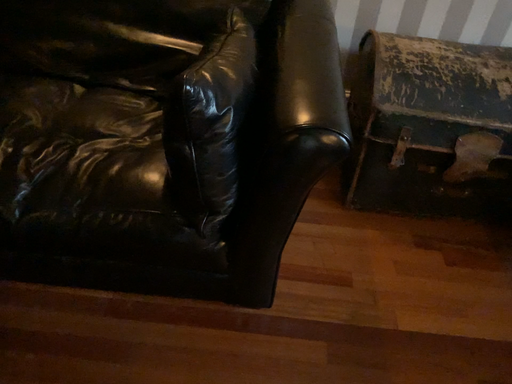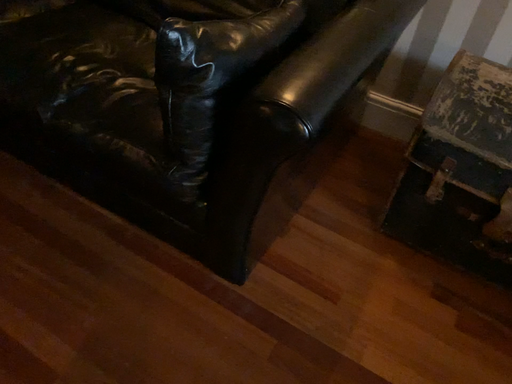
Question: How did the camera likely rotate when shooting the video?

Choices:
 (A) rotated left
 (B) rotated right

Answer: (A)